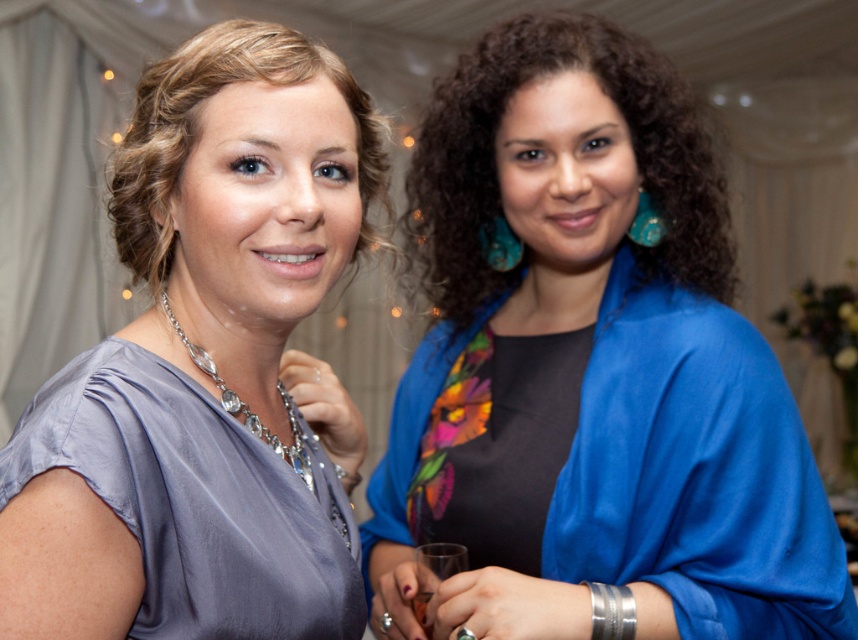
Question: Estimate the real-world distances between objects in this image. Which object is farther from the glossy plastic wine glass at center?

Choices:
 (A) satin gray blouse at upper left
 (B) clear glass wine glass at lower center

Answer: (A)

Question: Does satin dress at left appear under swarovski crystal necklace at left?

Choices:
 (A) yes
 (B) no

Answer: (A)

Question: Which point is farther from the camera taking this photo?

Choices:
 (A) (494, 602)
 (B) (421, 604)

Answer: (B)

Question: Among these objects, which one is nearest to the camera?

Choices:
 (A) clear glass wine glass at lower center
 (B) blue satin kimono at center
 (C) satin gray blouse at upper left
 (D) glossy plastic wine glass at center

Answer: (C)

Question: Observing the image, what is the correct spatial positioning of swarovski crystal necklace at left in reference to clear glass wine glass at lower center?

Choices:
 (A) right
 (B) left

Answer: (B)

Question: Does clear glass wine glass at lower center have a smaller size compared to glossy plastic wine glass at center?

Choices:
 (A) no
 (B) yes

Answer: (A)